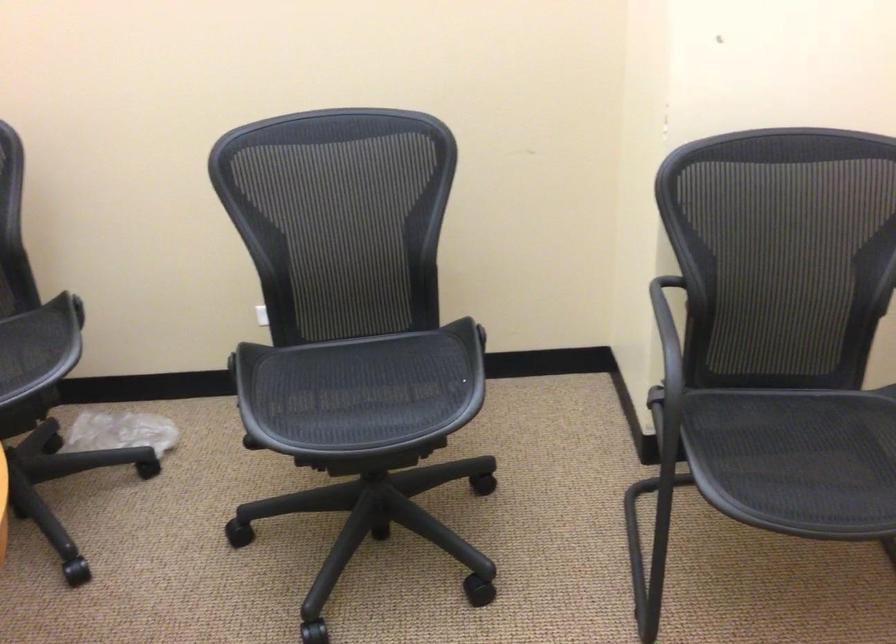
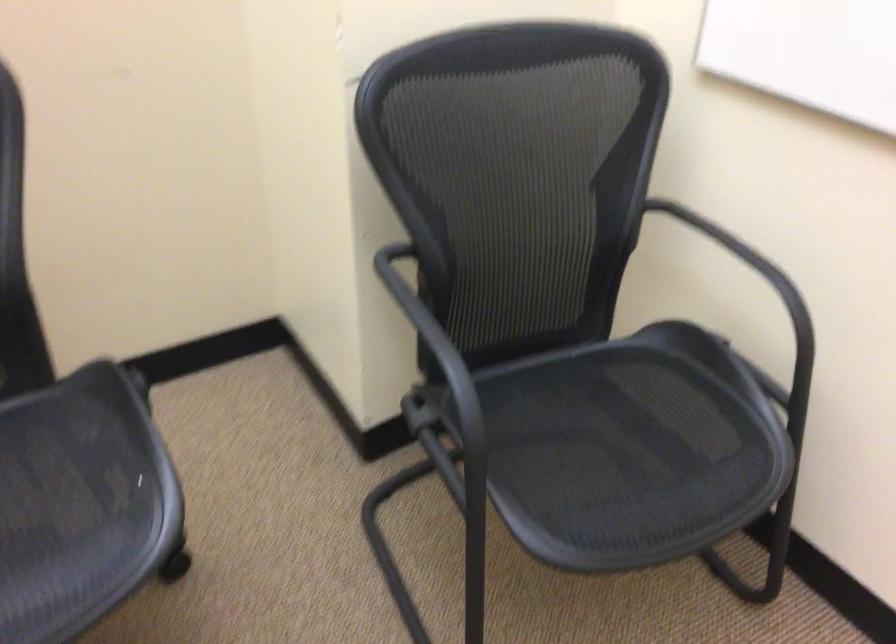
In the second image, find the point that corresponds to pixel 815 460 in the first image.

(626, 453)